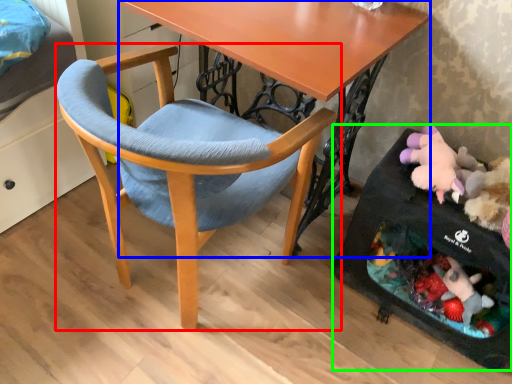
Question: Which object is positioned closest to chair (highlighted by a red box)? Select from desk (highlighted by a blue box) and baby carriage (highlighted by a green box).

Choices:
 (A) desk
 (B) baby carriage

Answer: (A)